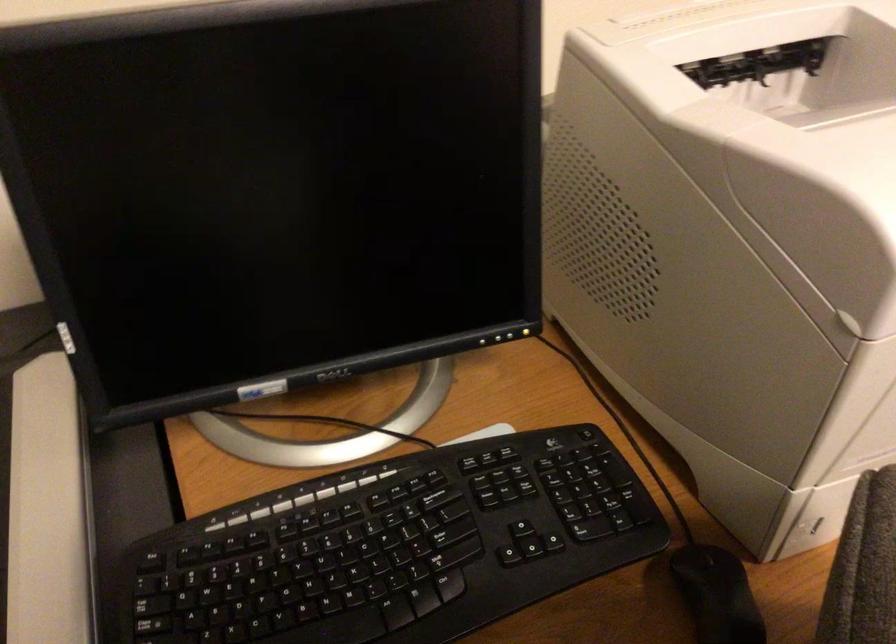
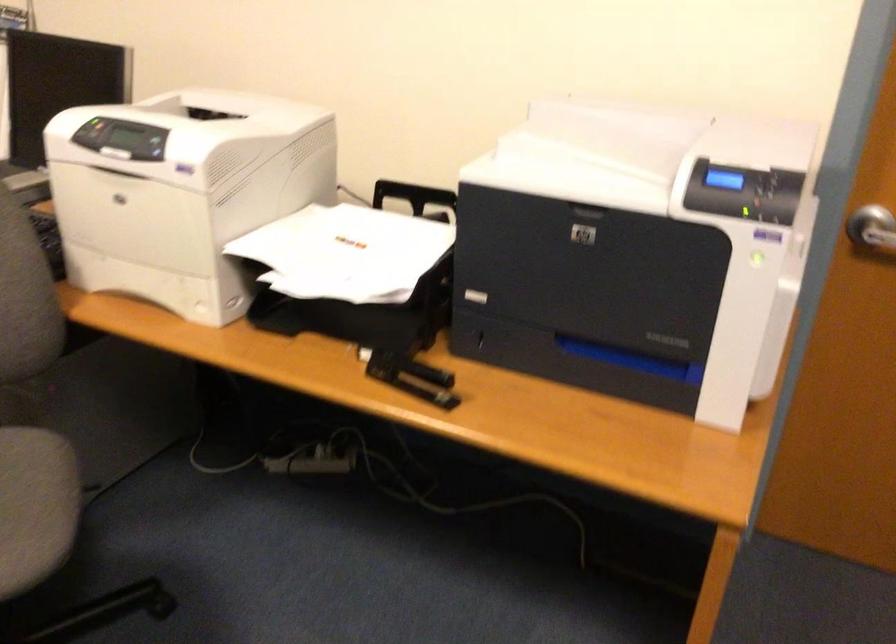
Question: I am providing you with two images of the same scene from different viewpoints. Please identify which objects are invisible in image2.

Choices:
 (A) red key tag
 (B) monitor power button
 (C) black stapler
 (D) silver door handle

Answer: (B)